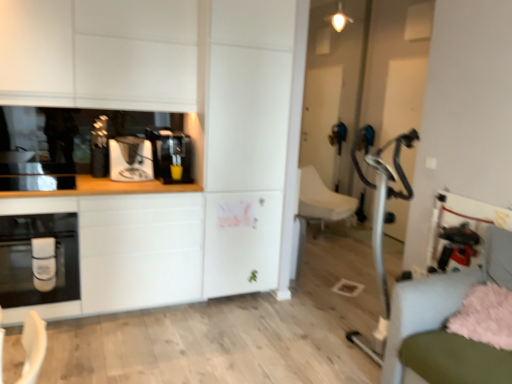
Question: From a real-world perspective, is matte black oven at left above or below white matte countertop at left?

Choices:
 (A) below
 (B) above

Answer: (B)

Question: Based on their sizes in the image, would you say matte black oven at left is bigger or smaller than white matte countertop at left?

Choices:
 (A) small
 (B) big

Answer: (A)

Question: Which is nearer to the white matte countertop at left?

Choices:
 (A) white matte cabinet at upper left
 (B) satin black coffee machine at left, acting as the second coffee machine starting from the right
 (C) white fabric swivel chair at center, positioned as the first swivel chair in back-to-front order
 (D) matte black oven at left
 (E) fluffy pink pillow at lower right

Answer: (D)

Question: Considering the real-world distances, which object is farthest from the black glossy toaster at left?

Choices:
 (A) matte black oven at left
 (B) light blue fabric swivel chair at lower right, positioned as the second swivel chair in back-to-front order
 (C) satin black coffee machine at left, the 1th coffee machine positioned from the left
 (D) white matte countertop at left
 (E) fluffy pink pillow at lower right

Answer: (E)